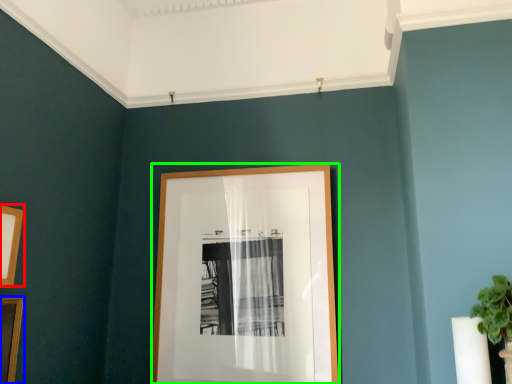
Question: Which object is positioned farthest from picture frame (highlighted by a red box)? Select from picture frame (highlighted by a blue box) and picture frame (highlighted by a green box).

Choices:
 (A) picture frame
 (B) picture frame

Answer: (B)